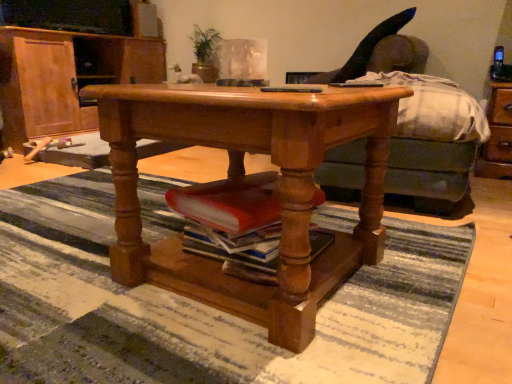
Question: Considering the relative sizes of black plastic remote control at center and green leafy plant at upper center in the image provided, is black plastic remote control at center thinner than green leafy plant at upper center?

Choices:
 (A) no
 (B) yes

Answer: (B)

Question: Are black plastic remote control at center and green leafy plant at upper center located far from each other?

Choices:
 (A) yes
 (B) no

Answer: (A)

Question: From the image's perspective, is black plastic remote control at center over green leafy plant at upper center?

Choices:
 (A) no
 (B) yes

Answer: (A)

Question: Is black plastic remote control at center further to camera compared to green leafy plant at upper center?

Choices:
 (A) yes
 (B) no

Answer: (B)

Question: Does black plastic remote control at center have a larger size compared to green leafy plant at upper center?

Choices:
 (A) no
 (B) yes

Answer: (A)

Question: Is green fabric couch at center to the left or to the right of wooden cabinet at left in the image?

Choices:
 (A) right
 (B) left

Answer: (A)

Question: From a real-world perspective, relative to wooden cabinet at left, is green fabric couch at center vertically above or below?

Choices:
 (A) below
 (B) above

Answer: (A)

Question: Considering the positions of point (471, 206) and point (74, 66), is point (471, 206) closer or farther from the camera than point (74, 66)?

Choices:
 (A) closer
 (B) farther

Answer: (A)

Question: In terms of size, does green fabric couch at center appear bigger or smaller than wooden cabinet at left?

Choices:
 (A) big
 (B) small

Answer: (B)

Question: Considering the positions of wooden table at center and striped rug at center in the image, is wooden table at center wider or thinner than striped rug at center?

Choices:
 (A) wide
 (B) thin

Answer: (B)

Question: From a real-world perspective, is wooden table at center positioned above or below striped rug at center?

Choices:
 (A) above
 (B) below

Answer: (A)

Question: From the image's perspective, is wooden table at center above or below striped rug at center?

Choices:
 (A) below
 (B) above

Answer: (B)

Question: From their relative heights in the image, would you say wooden table at center is taller or shorter than striped rug at center?

Choices:
 (A) short
 (B) tall

Answer: (B)

Question: Is wooden cabinet at left wider or thinner than wooden table at center?

Choices:
 (A) thin
 (B) wide

Answer: (B)

Question: In terms of height, does wooden cabinet at left look taller or shorter compared to wooden table at center?

Choices:
 (A) tall
 (B) short

Answer: (A)